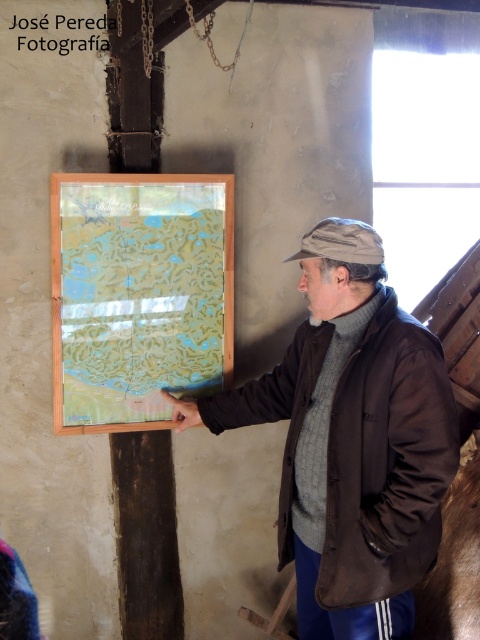
Based on the photo, you are a visitor in the room and want to see the translucent paper map at center clearly. However, the matte brown jacket at center is blocking your view. Can you move the jacket to get a better look at the map?

The matte brown jacket at center is in front of the translucent paper map at center, so moving the jacket would allow you to see the map more clearly.

You are standing in the room and looking at the map on the wall. There are two points marked on the map at coordinates point [420,573] and point [79,243]. Which of these points is closer to you?

Point [420,573] is closer to the viewer than point [79,243].